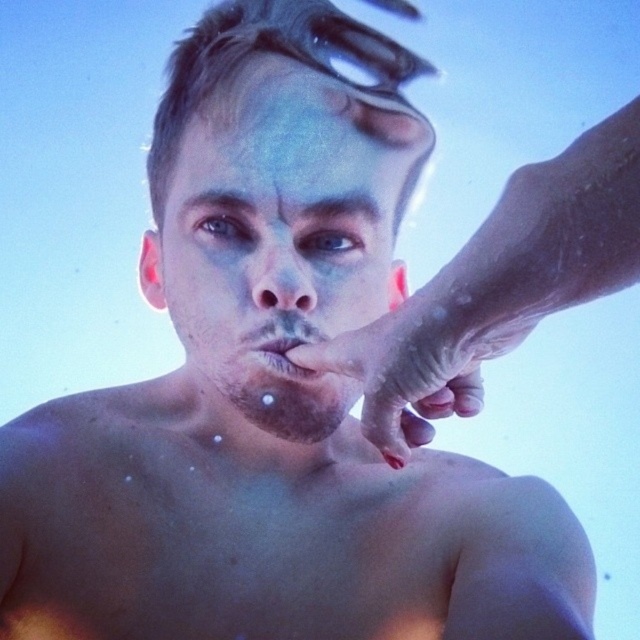
Between point (436, 413) and point (260, 301), which one is positioned in front?

Point (436, 413) is in front.

Identify the location of dry skin hand at center. (408, 365).

Where is `dry skin hand at center`? This screenshot has height=640, width=640. dry skin hand at center is located at coordinates (408, 365).

Which of these two, shiny metallic forehead at center or smooth skin nose at center, stands shorter?

smooth skin nose at center is shorter.

Measure the distance between shiny metallic forehead at center and camera.

The distance of shiny metallic forehead at center from camera is 27.37 inches.

Image resolution: width=640 pixels, height=640 pixels. I want to click on shiny metallic forehead at center, so click(x=291, y=102).

Can you confirm if transparent plastic goggles at upper center is positioned to the left of smooth skin nose at center?

No, transparent plastic goggles at upper center is not to the left of smooth skin nose at center.

Is point (346, 26) in front of point (275, 301)?

No, it is behind (275, 301).

Identify the location of transparent plastic goggles at upper center. (317, 42).

The height and width of the screenshot is (640, 640). Identify the location of transparent plastic goggles at upper center. (317, 42).